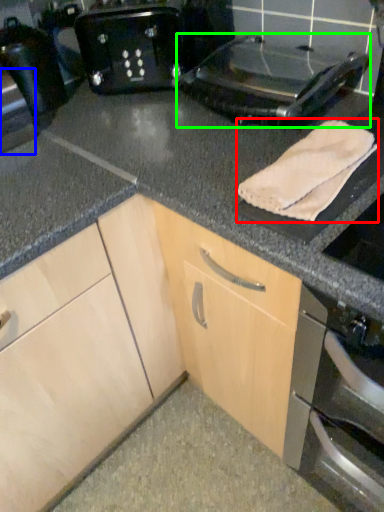
Question: Considering the real-world distances, which object is farthest from bath towel (highlighted by a red box)? appliance (highlighted by a blue box) or kitchen appliance (highlighted by a green box)?

Choices:
 (A) appliance
 (B) kitchen appliance

Answer: (A)